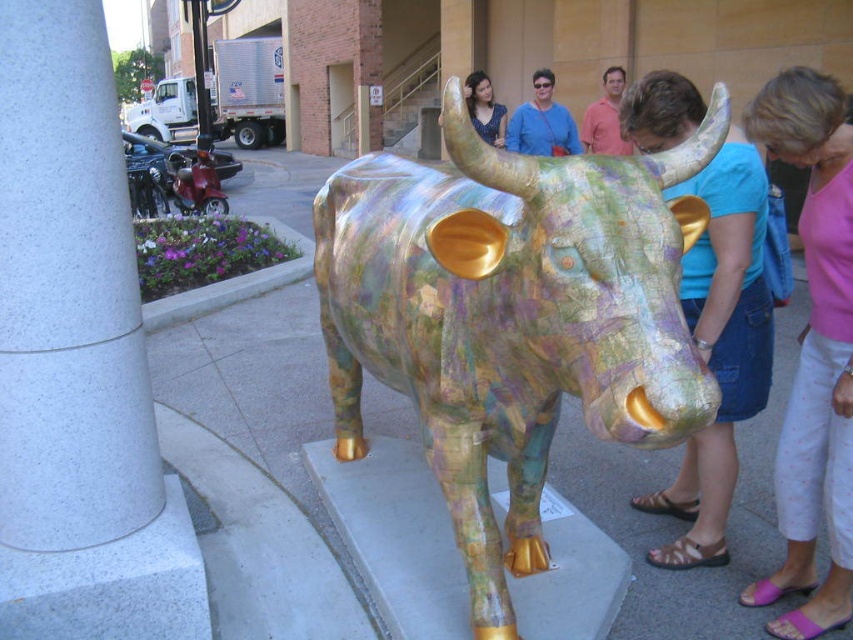
You are standing in front of the sculpture and want to take a photo of the multicolored map paper bull at center without any people in the frame. Since the bull is 1.50 meters away from you, can you step back to get a clear shot without moving the people?

The multicolored map paper bull at center is 1.50 meters away from the viewer. Since you can step back to get a wider angle, you can move back to capture the bull without the people as long as there is enough space behind you.